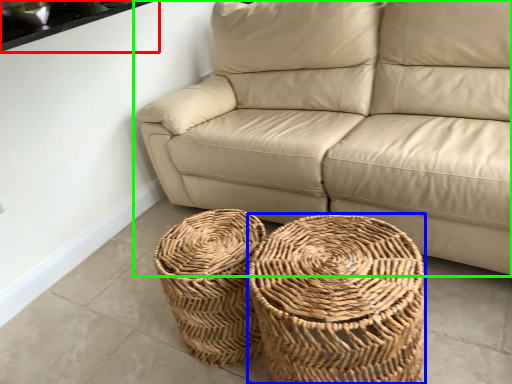
Question: Which is nearer to the window sill (highlighted by a red box)? basket (highlighted by a blue box) or studio couch (highlighted by a green box).

Choices:
 (A) basket
 (B) studio couch

Answer: (B)